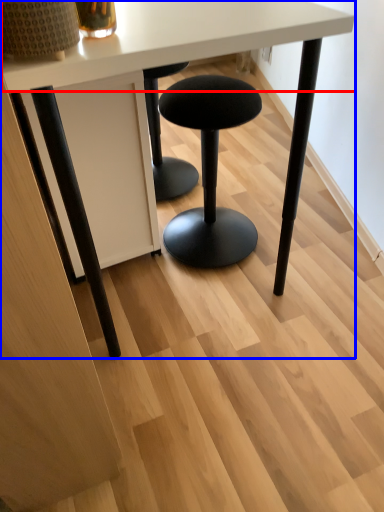
Question: Which object appears closest to the camera in this image, round table (highlighted by a red box) or table (highlighted by a blue box)?

Choices:
 (A) round table
 (B) table

Answer: (A)